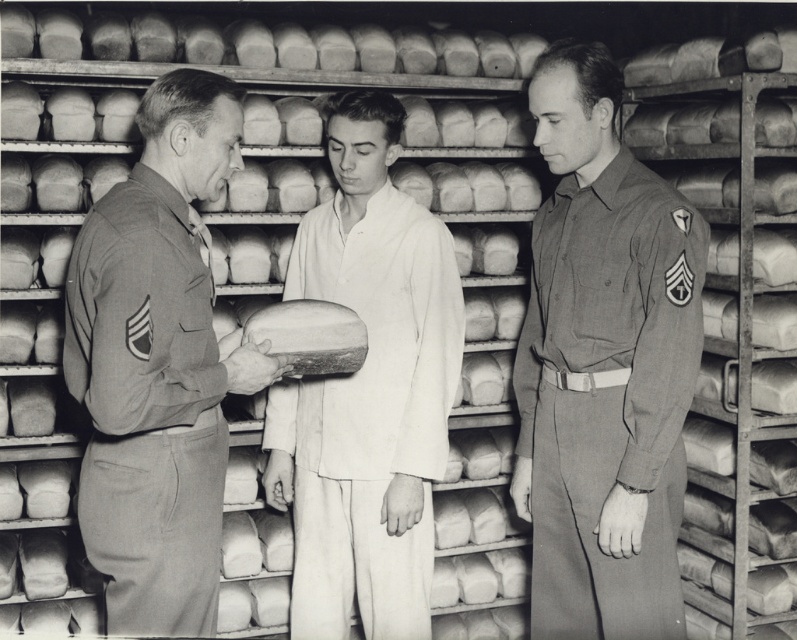
Looking at this image, in the historical bakery scene, there are two individuals wearing the matte khaki uniform at center and the white cotton kimono at center. Which of these two is wearing a larger garment?

The matte khaki uniform at center is bigger than the white cotton kimono at center, so the person wearing the matte khaki uniform at center has the larger garment.

You are a photographer analyzing the composition of this black and white image. You notice a point at coordinates (607,396). Which object from the scene does this point correspond to?

The point at coordinates (607,396) corresponds to the gray cotton uniform at right.

You are a photographer adjusting your camera in a historical bakery scene. You need to focus on both the matte khaki uniform at center and the gray cotton uniform at right. Which uniform should you focus on first to ensure it appears sharp in the photo?

You should focus on the matte khaki uniform at center first because it is closer to the viewer than the gray cotton uniform at right, so adjusting focus starting from the closer object ensures both will be in focus.